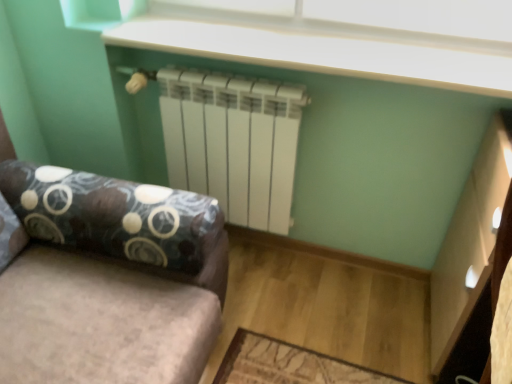
Question: Could you tell me if white plastic window screen at upper center is turned towards velvet fabric studio couch at center?

Choices:
 (A) yes
 (B) no

Answer: (B)

Question: Does white plastic window screen at upper center have a lesser height compared to velvet fabric studio couch at center?

Choices:
 (A) no
 (B) yes

Answer: (B)

Question: Is white plastic window screen at upper center positioned far away from velvet fabric studio couch at center?

Choices:
 (A) no
 (B) yes

Answer: (A)

Question: Can you confirm if white plastic window screen at upper center is thinner than velvet fabric studio couch at center?

Choices:
 (A) yes
 (B) no

Answer: (A)

Question: Does white plastic window screen at upper center come in front of velvet fabric studio couch at center?

Choices:
 (A) yes
 (B) no

Answer: (B)

Question: From a real-world perspective, is velvet fabric studio couch at center above or below white matte radiator at center?

Choices:
 (A) below
 (B) above

Answer: (A)

Question: Is velvet fabric studio couch at center bigger or smaller than white matte radiator at center?

Choices:
 (A) small
 (B) big

Answer: (B)

Question: In the image, is velvet fabric studio couch at center on the left side or the right side of white matte radiator at center?

Choices:
 (A) left
 (B) right

Answer: (A)

Question: Considering the positions of velvet fabric studio couch at center and white matte radiator at center in the image, is velvet fabric studio couch at center wider or thinner than white matte radiator at center?

Choices:
 (A) thin
 (B) wide

Answer: (B)

Question: Which is correct: velvet fabric studio couch at center is inside white plastic window screen at upper center, or outside of it?

Choices:
 (A) inside
 (B) outside

Answer: (B)

Question: Is velvet fabric studio couch at center taller or shorter than white plastic window screen at upper center?

Choices:
 (A) short
 (B) tall

Answer: (B)

Question: In the image, is velvet fabric studio couch at center positioned in front of or behind white plastic window screen at upper center?

Choices:
 (A) front
 (B) behind

Answer: (A)

Question: From the image's perspective, relative to white plastic window screen at upper center, is velvet fabric studio couch at center above or below?

Choices:
 (A) above
 (B) below

Answer: (B)

Question: Is white plastic window screen at upper center taller or shorter than white matte radiator at center?

Choices:
 (A) tall
 (B) short

Answer: (B)

Question: Based on their sizes in the image, would you say white plastic window screen at upper center is bigger or smaller than white matte radiator at center?

Choices:
 (A) small
 (B) big

Answer: (A)